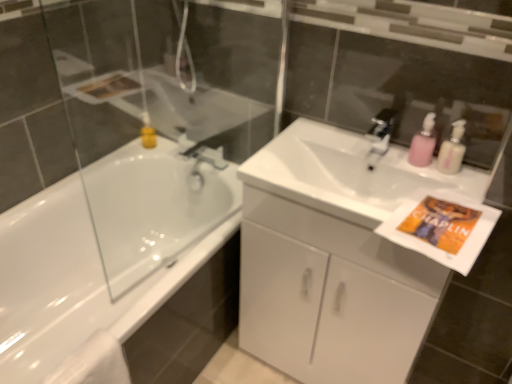
What are the coordinates of `vacant space to the left of pink plastic pump at upper right` in the screenshot? It's located at (394, 158).